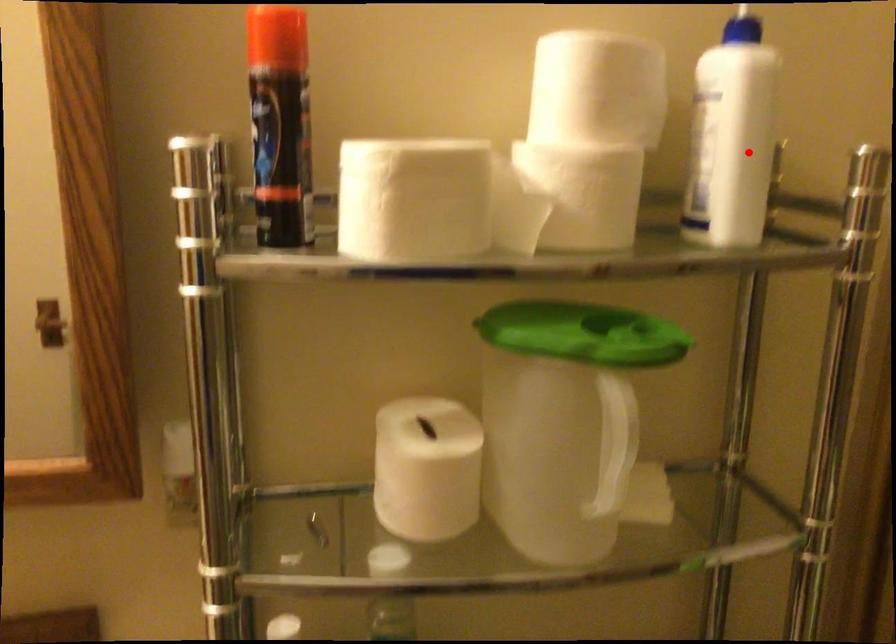
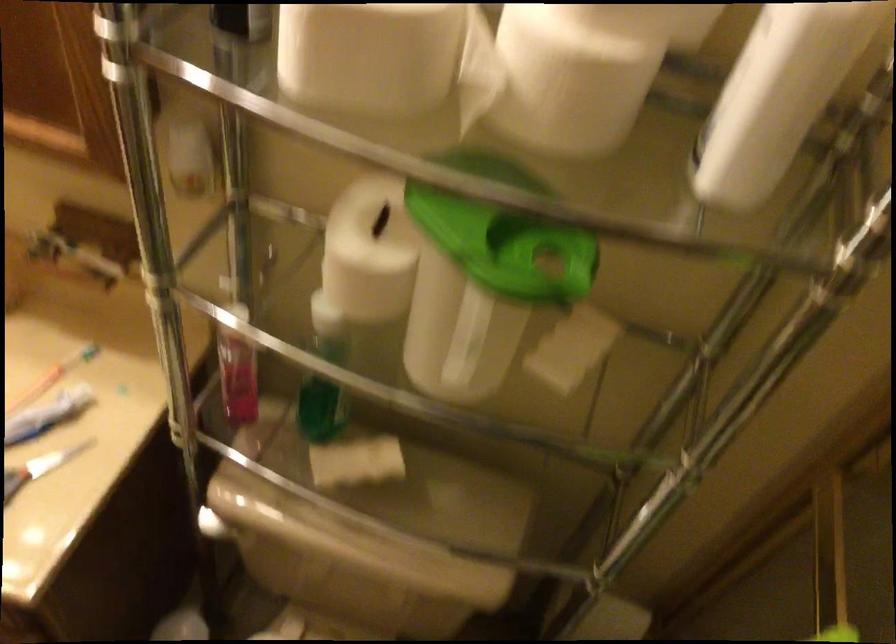
Question: I am providing you with two images of the same scene from different viewpoints. In image1, a red point is highlighted. Considering the same 3D point in image2, which of the following is correct?

Choices:
 (A) It is closer
 (B) It is farther

Answer: (A)